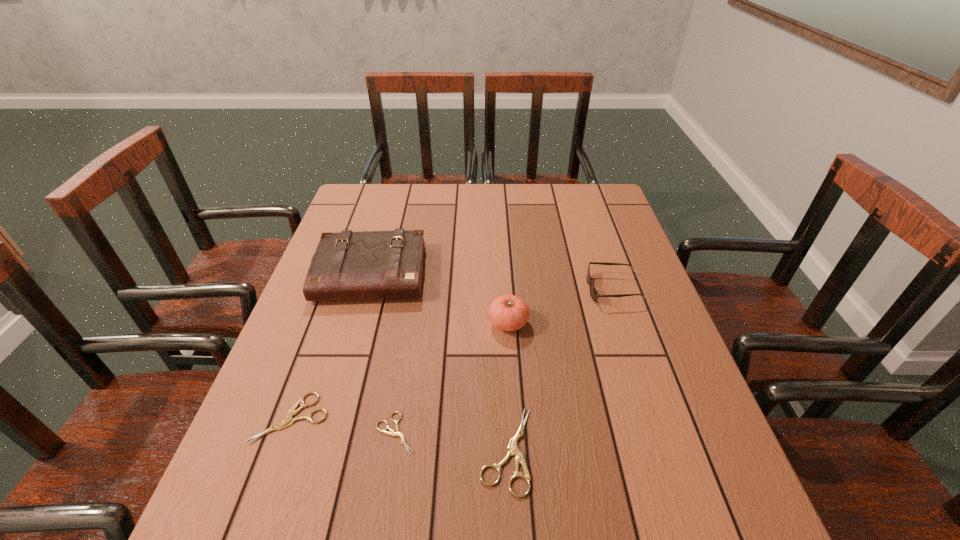
This screenshot has height=540, width=960. Identify the location of vacant point located between the leftmost shears and the rightmost object. pos(452,353).

Locate an element on the screen. This screenshot has height=540, width=960. blank region between the sunglasses and the second shortest shears is located at coordinates (452, 353).

I want to click on unoccupied area between the leftmost shears and the sunglasses, so click(x=452, y=353).

This screenshot has height=540, width=960. Identify the location of free space between the second shortest object and the sunglasses. (452, 353).

Point out which object is positioned as the nearest to the fifth tallest object. Please provide its 2D coordinates. Your answer should be formatted as a tuple, i.e. [(x, y)], where the tuple contains the x and y coordinates of a point satisfying the conditions above.

[(398, 433)]

Find the location of a particular element. This screenshot has width=960, height=540. object that is the fifth closest to the shortest object is located at coordinates (594, 294).

At what (x,y) coordinates should I click in order to perform the action: click on shears that is the second closest one to the tomato. Please return your answer as a coordinate pair (x, y). The image size is (960, 540). Looking at the image, I should click on (398, 433).

Point out which shears is positioned as the nearest to the rightmost shears. Please provide its 2D coordinates. Your answer should be formatted as a tuple, i.e. [(x, y)], where the tuple contains the x and y coordinates of a point satisfying the conditions above.

[(398, 433)]

Identify the location of vacant space that satisfies the following two spatial constraints: 1. on the front side of the rightmost shears; 2. on the right side of the hardback book. This screenshot has height=540, width=960. (320, 450).

This screenshot has width=960, height=540. Identify the location of vacant area in the image that satisfies the following two spatial constraints: 1. on the back side of the fifth tallest object; 2. on the right side of the tomato. (325, 323).